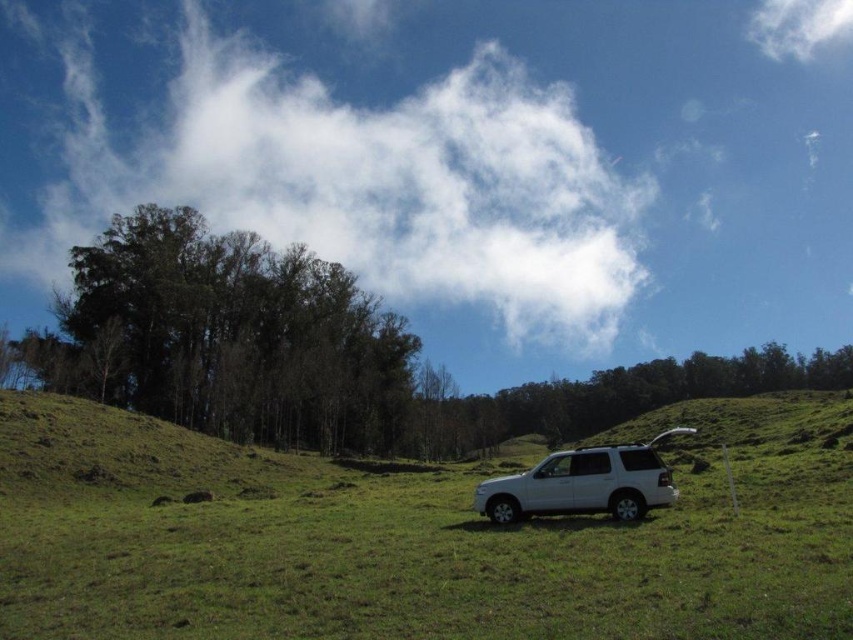
You are standing in the middle of the green grassy field at center and looking up at the sky. Which direction should you turn to see the white fluffy cloud at upper center first?

You should turn to your left because the green grassy field at center is positioned on the right side of the white fluffy cloud at upper center, meaning the cloud is to the left of the field from your perspective.

You are a photographer planning to capture the white fluffy cloud at upper center and the white matte suv at center in the same frame. Which object appears larger in the image?

The white fluffy cloud at upper center appears larger because it is much taller than the white matte suv at center.

You are standing at the point with coordinates point (550, 332) and want to walk towards the white SUV parked on the grassy area. Will the point with coordinates point (560, 534) block your path?

Point (560, 534) is in front of point (550, 332), so yes, the point with coordinates point (560, 534) will block your path to the white SUV parked on the grassy area.